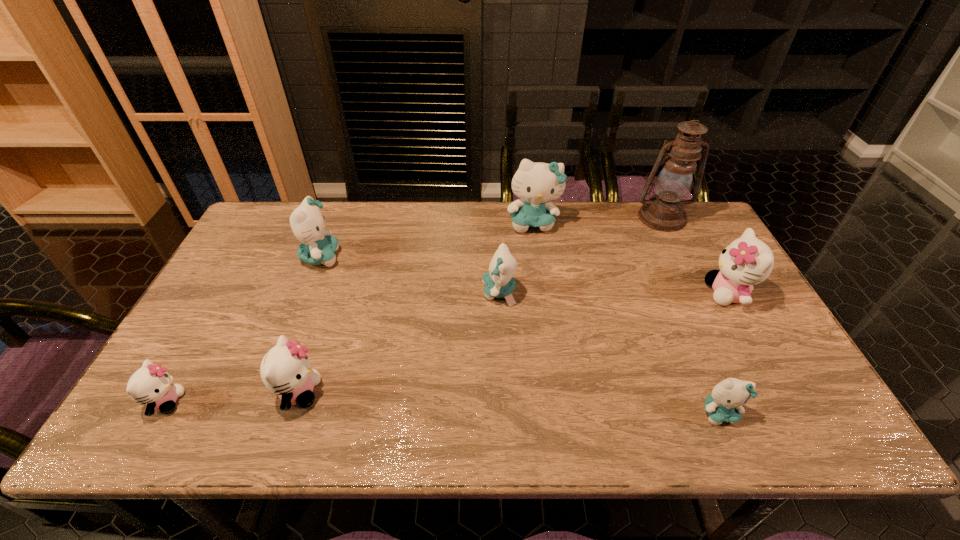
Identify the location of unoccupied position between the second smallest blue kitten and the second smallest white kitten. The width and height of the screenshot is (960, 540). (399, 342).

Identify the location of unoccupied area between the rightmost white kitten and the second biggest white kitten. The height and width of the screenshot is (540, 960). (514, 343).

Where is `free spot between the second white kitten from left to right and the leftmost kitten`? The width and height of the screenshot is (960, 540). free spot between the second white kitten from left to right and the leftmost kitten is located at coordinates (232, 397).

Where is `free space between the second smallest white kitten and the third nearest blue kitten`? The width and height of the screenshot is (960, 540). free space between the second smallest white kitten and the third nearest blue kitten is located at coordinates (310, 325).

Image resolution: width=960 pixels, height=540 pixels. I want to click on empty space between the sixth kitten from left to right and the oil lamp, so click(690, 315).

Image resolution: width=960 pixels, height=540 pixels. I want to click on blank region between the third farthest blue kitten and the tallest kitten, so click(516, 258).

Point out which object is positioned as the fourth nearest to the leftmost white kitten. Please provide its 2D coordinates. Your answer should be formatted as a tuple, i.e. [(x, y)], where the tuple contains the x and y coordinates of a point satisfying the conditions above.

[(536, 184)]

Select which object appears as the second closest to the second biggest white kitten. Please provide its 2D coordinates. Your answer should be formatted as a tuple, i.e. [(x, y)], where the tuple contains the x and y coordinates of a point satisfying the conditions above.

[(307, 222)]

Identify the location of the third closest kitten to the second smallest white kitten. (498, 282).

Identify which kitten is the closest to the second nearest blue kitten. Please provide its 2D coordinates. Your answer should be formatted as a tuple, i.e. [(x, y)], where the tuple contains the x and y coordinates of a point satisfying the conditions above.

[(536, 184)]